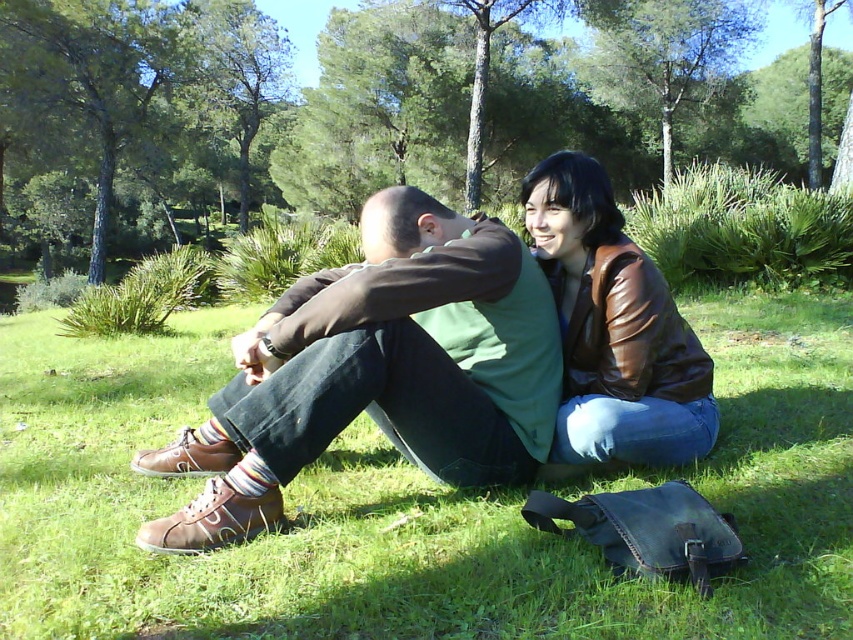
You are taking a photo of the two people in the park. You want to focus on the person closer to the camera. Which point should you use for focusing, point (97, 138) or point (654, 268)?

Point (97, 138) is further to the camera than point (654, 268), so you should use point (97, 138) for focusing as it is closer to the camera.

You are planning to place a small picnic basket on the green grass at center. The basket is 20 cm in width. Can the brown leather jacket at upper right be placed on the same spot without overlapping?

The green grass at center might be wider than brown leather jacket at upper right, so there is a possibility that the jacket can fit on the grass. However, since the exact width of the grass isn

You are standing in the park and see two points marked in the image. Which point, point (751, 304) or point (693, 113), is closer to you?

Point (751, 304) is closer to the viewer than point (693, 113).